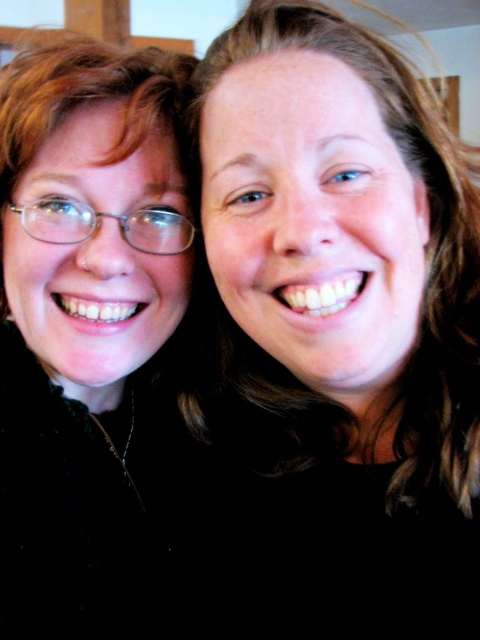
Question: Which of the following is the closest to the observer?

Choices:
 (A) matte black glasses at left
 (B) matte black hair at center

Answer: (B)

Question: Which object is closer to the camera taking this photo?

Choices:
 (A) matte black glasses at left
 (B) matte black hair at center

Answer: (B)

Question: Does matte black hair at center appear on the left side of matte black glasses at left?

Choices:
 (A) yes
 (B) no

Answer: (B)

Question: Which point is farther to the camera?

Choices:
 (A) (470, 372)
 (B) (126, 260)

Answer: (B)

Question: Can you confirm if matte black hair at center is wider than matte black glasses at left?

Choices:
 (A) yes
 (B) no

Answer: (A)

Question: In this image, where is matte black hair at center located relative to matte black glasses at left?

Choices:
 (A) above
 (B) below

Answer: (A)